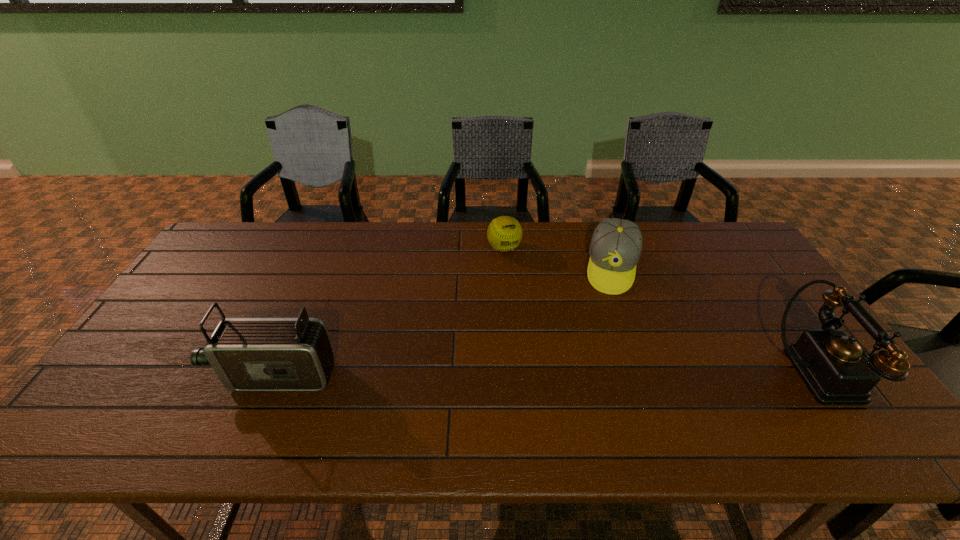
Identify the location of the leftmost object. The image size is (960, 540). pos(247,354).

Where is `telephone`? This screenshot has height=540, width=960. telephone is located at coordinates (838, 370).

In order to click on the third object from right to left in this screenshot , I will do `click(504, 233)`.

Locate an element on the screen. The height and width of the screenshot is (540, 960). the shortest object is located at coordinates (504, 233).

Where is `the third object from left to right`? The image size is (960, 540). the third object from left to right is located at coordinates (616, 244).

Locate an element on the screen. baseball cap is located at coordinates (616, 244).

This screenshot has height=540, width=960. Identify the location of vacant region located 0.090m at the lens of the leftmost object. (180, 375).

I want to click on free location located 0.170m at the lens of the leftmost object, so click(x=148, y=375).

The height and width of the screenshot is (540, 960). Find the location of `vacant space located at the lens of the leftmost object`. vacant space located at the lens of the leftmost object is located at coordinates (192, 375).

Identify the location of free space located 0.320m on the logo side of the third object from right to left. The height and width of the screenshot is (540, 960). (551, 327).